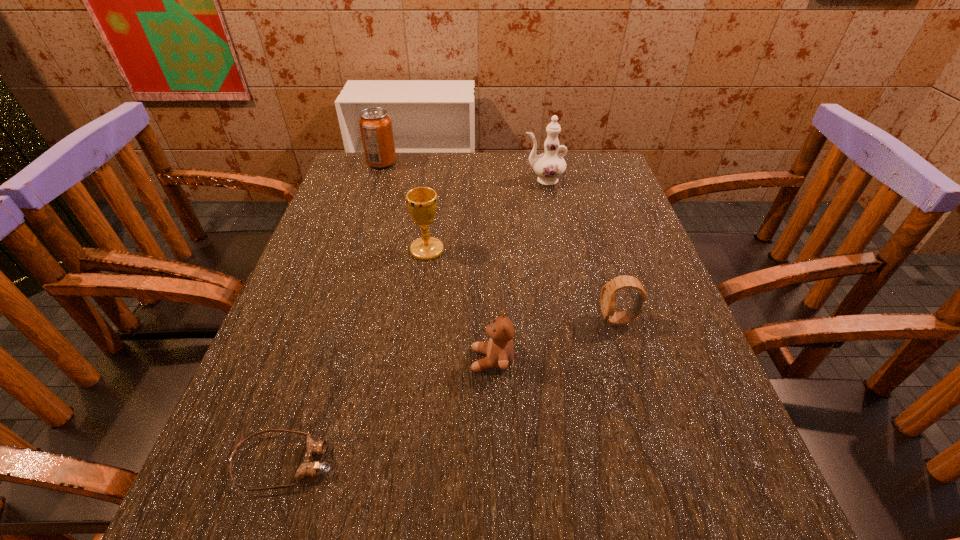
At what (x,y) coordinates should I click in order to perform the action: click on vacant space that satisfies the following two spatial constraints: 1. at the spout of the fifth nearest object; 2. on the front side of the fourth object from right to left. Please return your answer as a coordinate pair (x, y). Image resolution: width=960 pixels, height=540 pixels. Looking at the image, I should click on (558, 249).